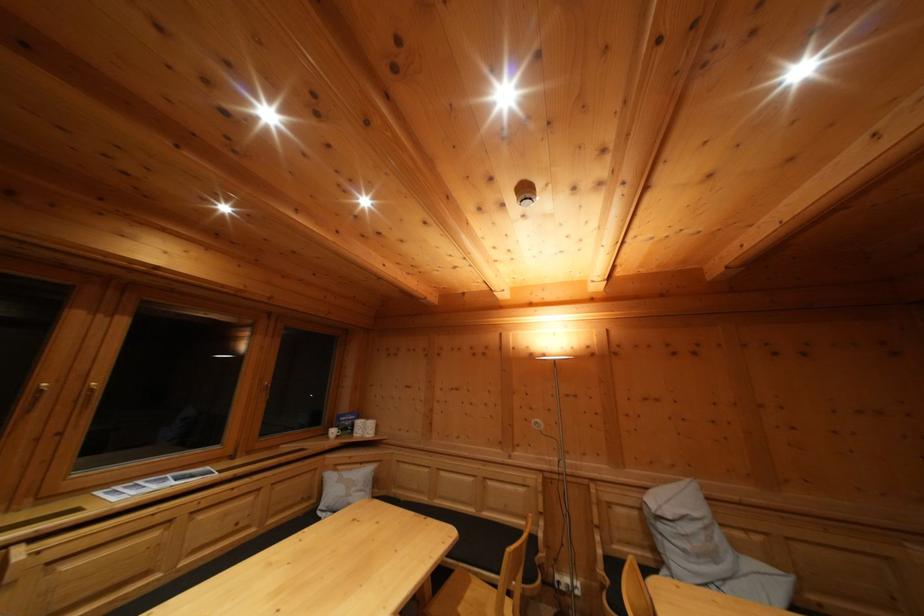
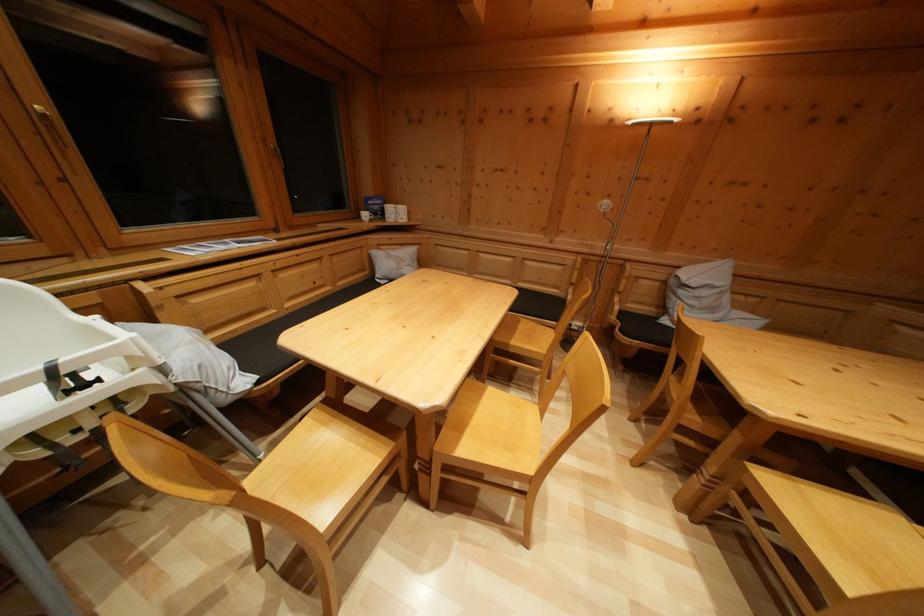
The point at (95,403) is marked in the first image. Where is the corresponding point in the second image?

(58, 135)